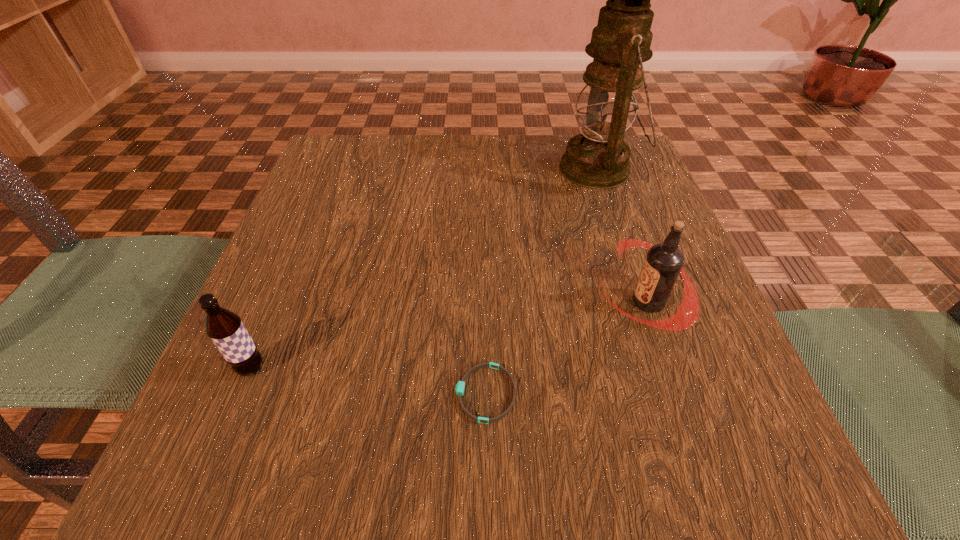
This screenshot has height=540, width=960. What are the coordinates of `empty location between the wristband and the farther root beer` in the screenshot? It's located at (566, 348).

Locate an element on the screen. vacant space in between the farther root beer and the farthest object is located at coordinates (623, 235).

Find the location of a particular element. The height and width of the screenshot is (540, 960). free space between the leftmost object and the oil lamp is located at coordinates (424, 269).

The width and height of the screenshot is (960, 540). I want to click on vacant area between the third object from right to left and the leftmost object, so click(369, 381).

I want to click on vacant area that lies between the tallest object and the left root beer, so [424, 269].

Identify the location of vacant area that lies between the third nearest object and the third object from right to left. The height and width of the screenshot is (540, 960). (566, 348).

Locate an element on the screen. The height and width of the screenshot is (540, 960). empty space that is in between the left root beer and the right root beer is located at coordinates (449, 335).

Identify the location of object that is the second closest to the left root beer. The height and width of the screenshot is (540, 960). (664, 261).

Select which object appears as the closest to the wristband. Please provide its 2D coordinates. Your answer should be formatted as a tuple, i.e. [(x, y)], where the tuple contains the x and y coordinates of a point satisfying the conditions above.

[(664, 261)]

Find the location of a particular element. Image resolution: width=960 pixels, height=540 pixels. free space that satisfies the following two spatial constraints: 1. on the label of the right root beer; 2. on the front side of the left root beer is located at coordinates (670, 368).